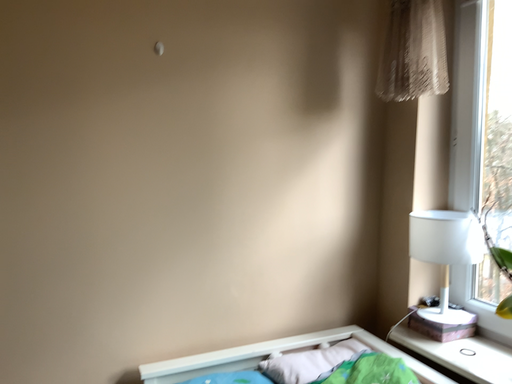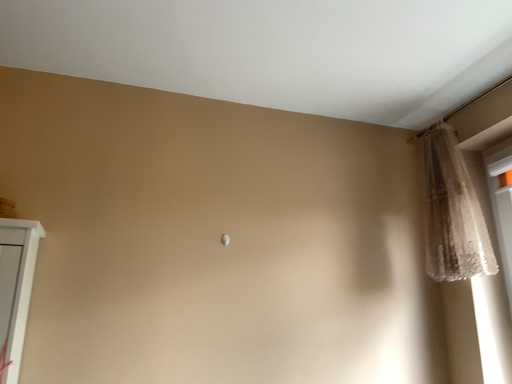
Question: Which way did the camera rotate in the video?

Choices:
 (A) rotated upward
 (B) rotated downward

Answer: (A)